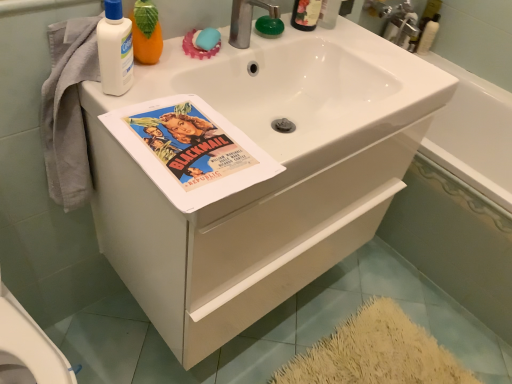
Where is `vacant area located to the right-hand side of white matte lotion at upper left, positioned as the 1th cleaning product in bottom-to-top order`? The height and width of the screenshot is (384, 512). vacant area located to the right-hand side of white matte lotion at upper left, positioned as the 1th cleaning product in bottom-to-top order is located at coordinates [x=177, y=110].